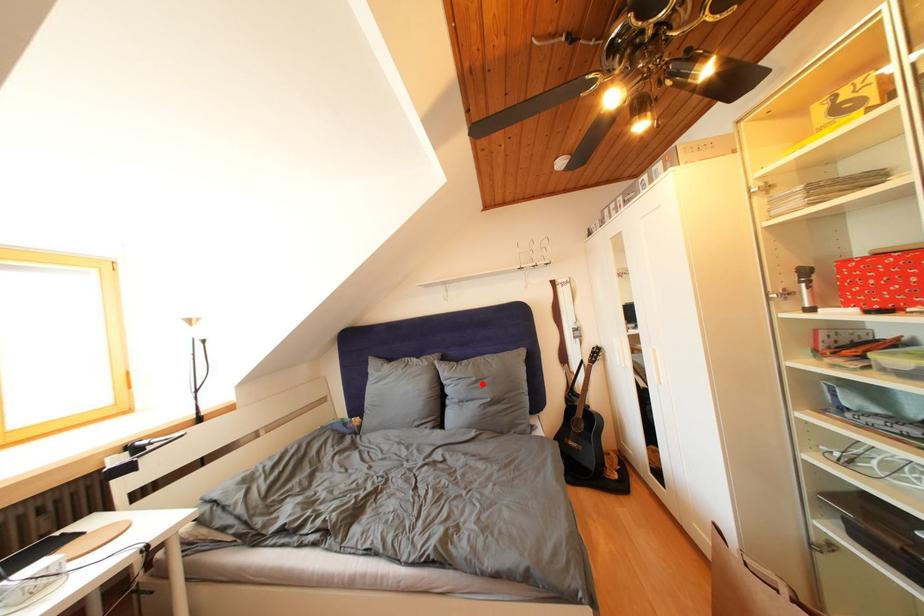
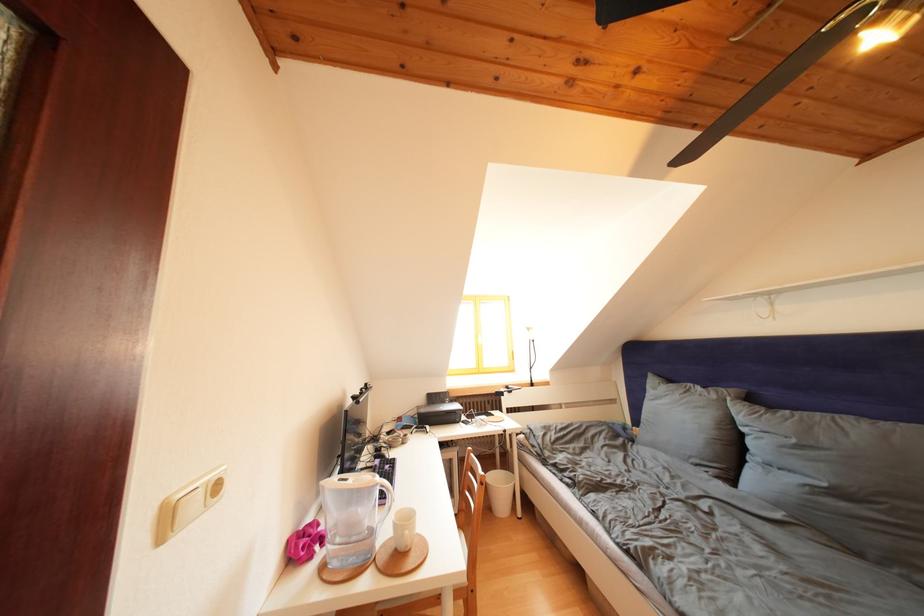
Question: I am providing you with two images of the same scene from different viewpoints. Image1 has a red point marked. In image2, the corresponding 3D location appears at what relative position? Reply with the corresponding letter.

Choices:
 (A) Closer
 (B) Farther

Answer: (A)